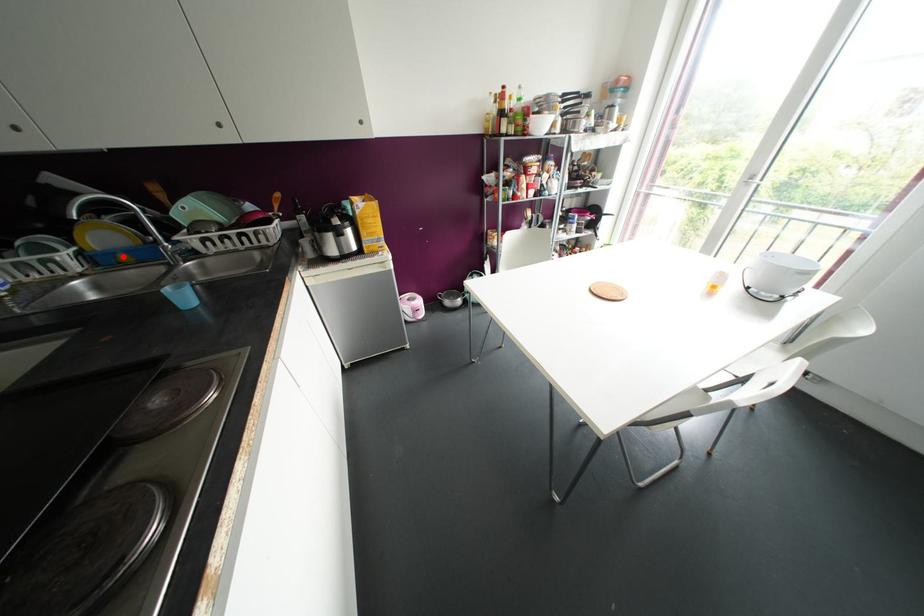
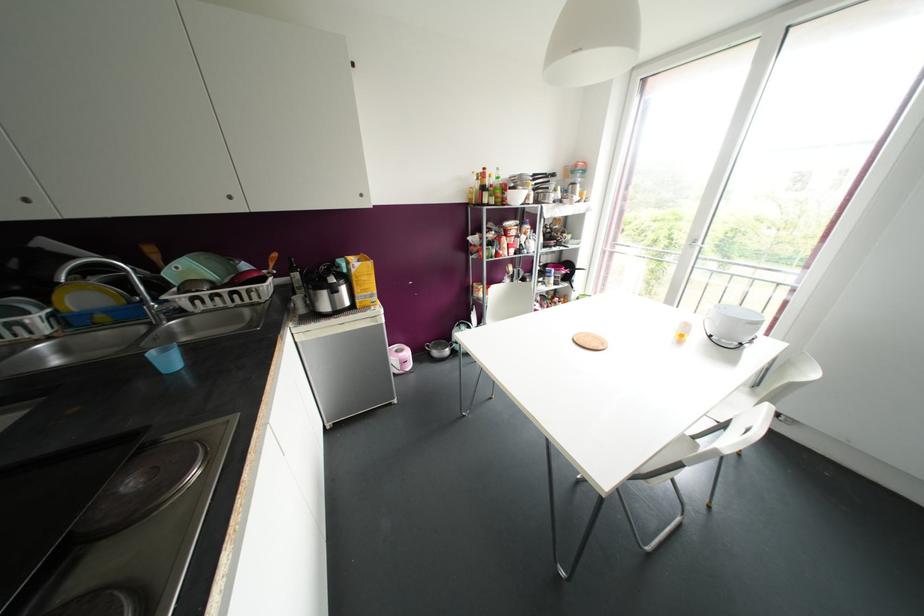
Where in the second image is the point corresponding to the highlighted location from the first image?

(101, 317)